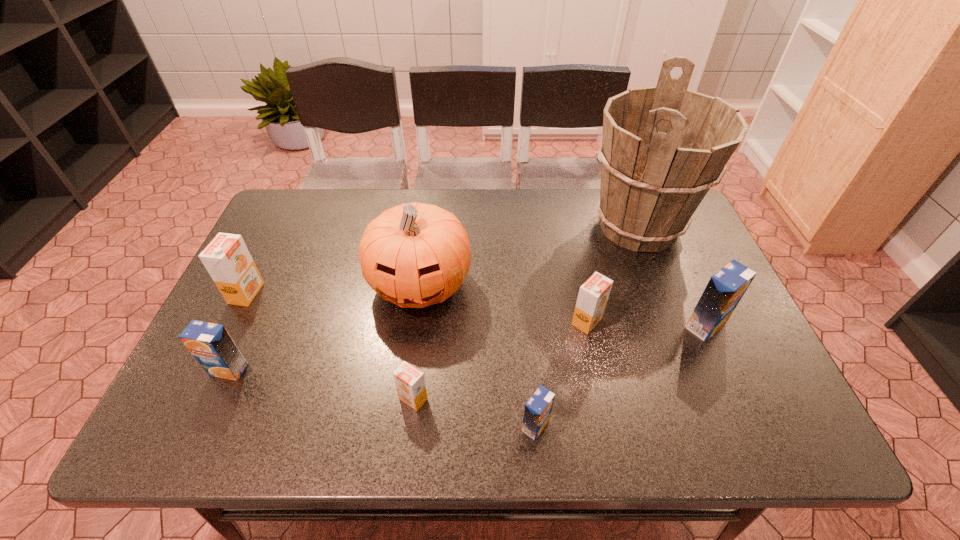
At what (x,y) coordinates should I click in order to perform the action: click on blank space at the far left corner of the desktop. Please return your answer as a coordinate pair (x, y). This screenshot has height=540, width=960. Looking at the image, I should click on (309, 209).

This screenshot has width=960, height=540. I want to click on vacant space at the near left corner of the desktop, so click(x=200, y=426).

Find the location of `free space between the fourth orange_juice from right to left and the second biggest orange orange juice`. free space between the fourth orange_juice from right to left and the second biggest orange orange juice is located at coordinates (500, 360).

Identify the location of vacant space that is in between the second orange orange juice from left to right and the orange pumpkin. (417, 341).

Find the location of a particular element. The image size is (960, 540). vacant area that lies between the second blue orange_juice from right to left and the second nearest object is located at coordinates (474, 413).

Locate an element on the screen. The height and width of the screenshot is (540, 960). vacant space in between the second farthest orange orange juice and the second orange orange juice from right to left is located at coordinates (500, 360).

You are a GUI agent. You are given a task and a screenshot of the screen. Output one action in this format:
    pyautogui.click(x=<x>, y=<y>)
    Task: Click on the vacant space in between the seventh farthest object and the bucket
    
    Given the screenshot: What is the action you would take?
    pyautogui.click(x=526, y=313)

Where is `free space between the rightmost blue orange_juice and the leftmost orange orange juice`? The height and width of the screenshot is (540, 960). free space between the rightmost blue orange_juice and the leftmost orange orange juice is located at coordinates (476, 309).

Find the location of `free space between the second orange orange juice from left to right and the sixth object from left to right`. free space between the second orange orange juice from left to right and the sixth object from left to right is located at coordinates (500, 360).

The width and height of the screenshot is (960, 540). Find the location of `empty space between the second smallest orange orange juice and the pumpkin`. empty space between the second smallest orange orange juice and the pumpkin is located at coordinates (503, 303).